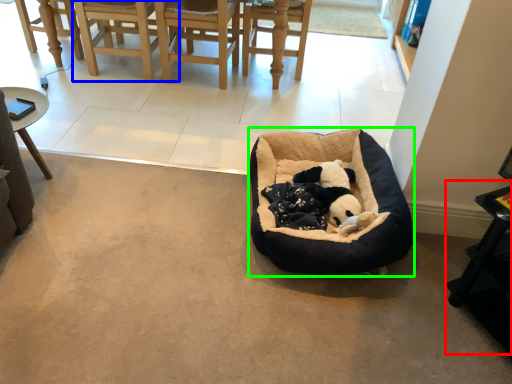
Question: Which object is the farthest from table (highlighted by a red box)? Choose among these: chair (highlighted by a blue box) or dog bed (highlighted by a green box).

Choices:
 (A) chair
 (B) dog bed

Answer: (A)